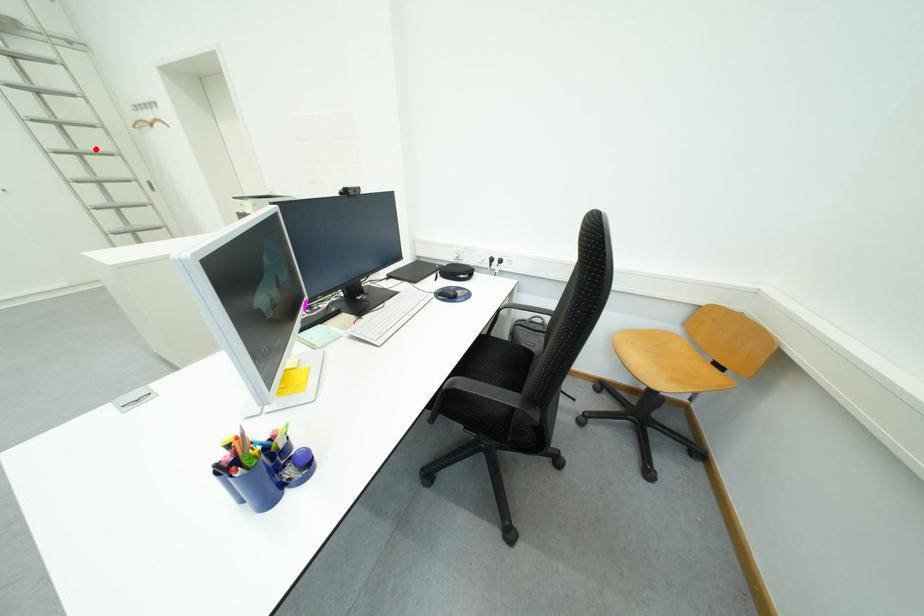
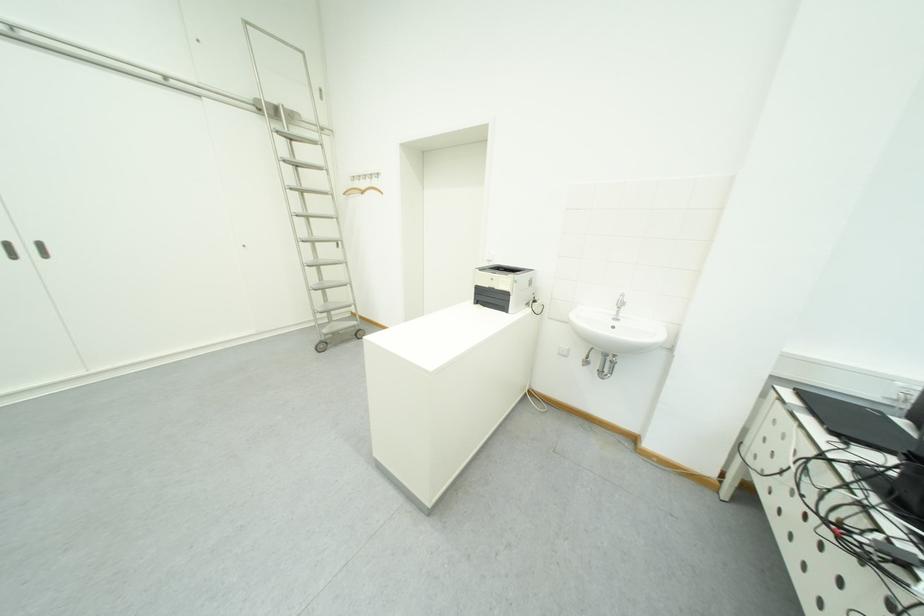
In the second image, find the point that corresponds to the highlighted location in the first image.

(322, 213)